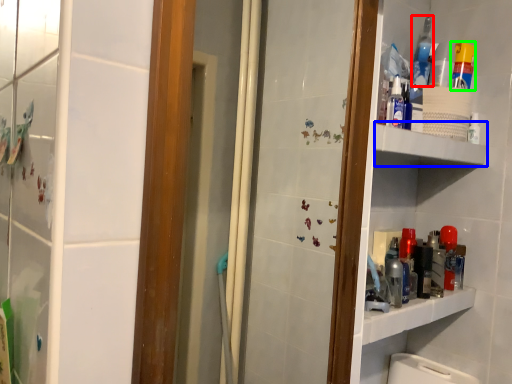
Question: Considering the real-world distances, which object is closest to mouthwash (highlighted by a red box)? shelve (highlighted by a blue box) or cleaning product (highlighted by a green box).

Choices:
 (A) shelve
 (B) cleaning product

Answer: (B)